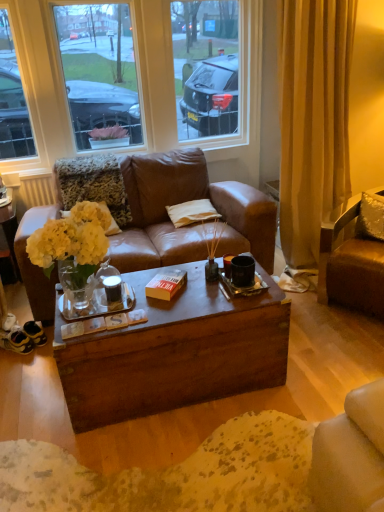
Question: Is beige fabric pillow at center, the second pillow positioned from the front, bigger or smaller than brown leather chair at right?

Choices:
 (A) big
 (B) small

Answer: (B)

Question: Visually, is beige fabric pillow at center, acting as the first pillow starting from the left, positioned to the left or to the right of brown leather chair at right?

Choices:
 (A) right
 (B) left

Answer: (B)

Question: Estimate the real-world distances between objects in this image. Which object is closer to the yellow matte flowers at center?

Choices:
 (A) orange matte book at center
 (B) brown leather chair at right
 (C) beige fabric pillow at center, positioned as the second pillow in right-to-left order
 (D) clear glass window at upper center
 (E) satin silver pillow at upper right, the first pillow in the front-to-back sequence

Answer: (A)

Question: Which object is the farthest from the orange matte book at center?

Choices:
 (A) clear glass window at upper center
 (B) yellow matte flowers at center
 (C) beige fabric pillow at center, the 1th pillow viewed from the back
 (D) brown leather chair at right
 (E) satin silver pillow at upper right, the first pillow in the front-to-back sequence

Answer: (A)